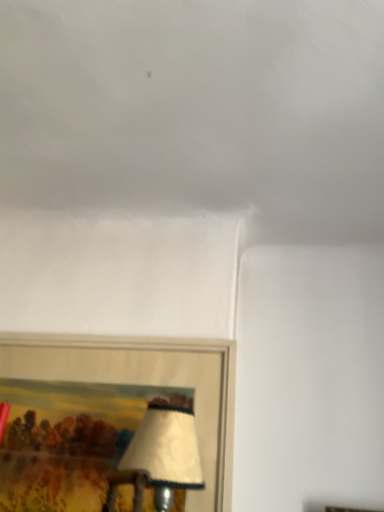
Question: Considering their positions, is white matte cloud at upper center located in front of or behind wooden picture frame at lower left?

Choices:
 (A) behind
 (B) front

Answer: (B)

Question: Is point (258, 172) positioned closer to the camera than point (203, 339)?

Choices:
 (A) farther
 (B) closer

Answer: (A)

Question: Based on their sizes in the image, would you say white matte cloud at upper center is bigger or smaller than wooden picture frame at lower left?

Choices:
 (A) small
 (B) big

Answer: (B)

Question: Considering their positions, is wooden picture frame at lower left located in front of or behind white matte cloud at upper center?

Choices:
 (A) behind
 (B) front

Answer: (A)

Question: In terms of width, does wooden picture frame at lower left look wider or thinner when compared to white matte cloud at upper center?

Choices:
 (A) thin
 (B) wide

Answer: (A)

Question: Is point (6, 352) closer or farther from the camera than point (178, 83)?

Choices:
 (A) closer
 (B) farther

Answer: (B)

Question: From the image's perspective, is wooden picture frame at lower left above or below white matte cloud at upper center?

Choices:
 (A) above
 (B) below

Answer: (B)